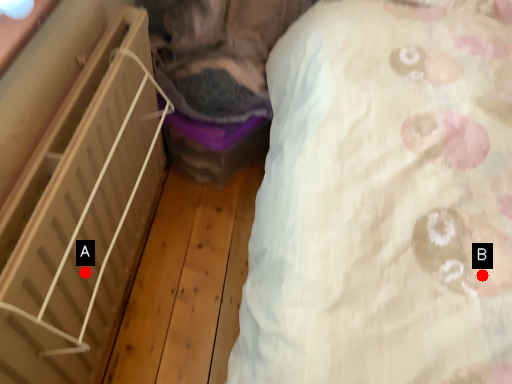
Question: Two points are circled on the image, labeled by A and B beside each circle. Which point is closer to the camera?

Choices:
 (A) A is closer
 (B) B is closer

Answer: (B)